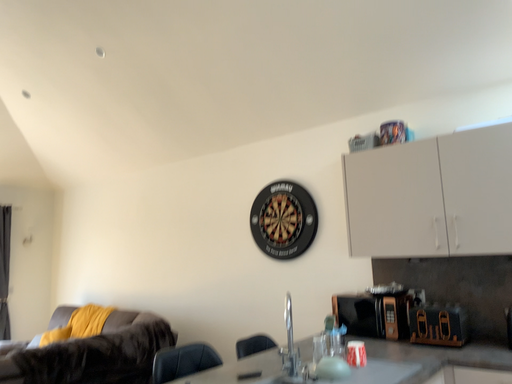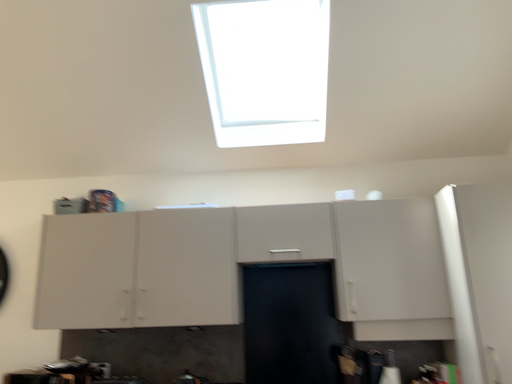
Question: How did the camera likely rotate when shooting the video?

Choices:
 (A) rotated left
 (B) rotated right

Answer: (B)